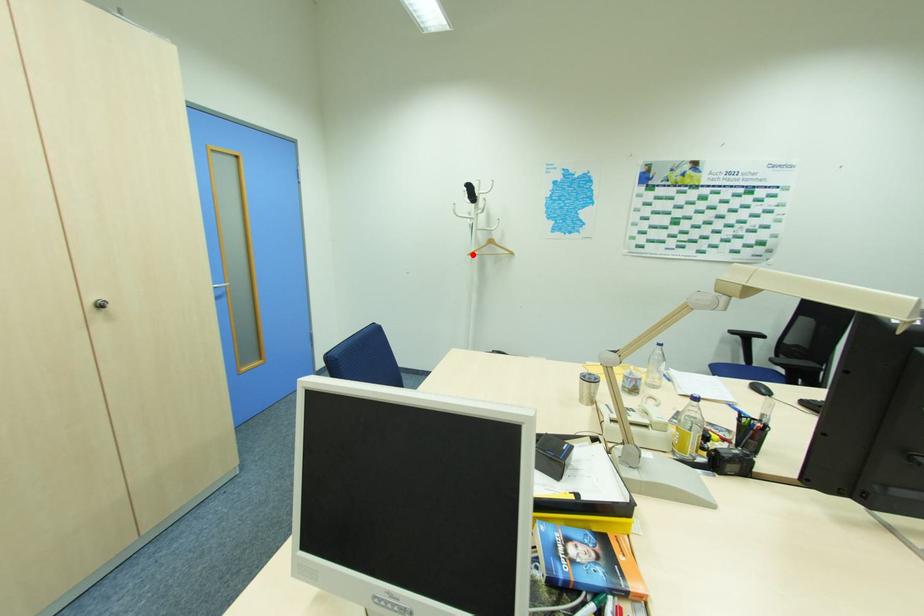
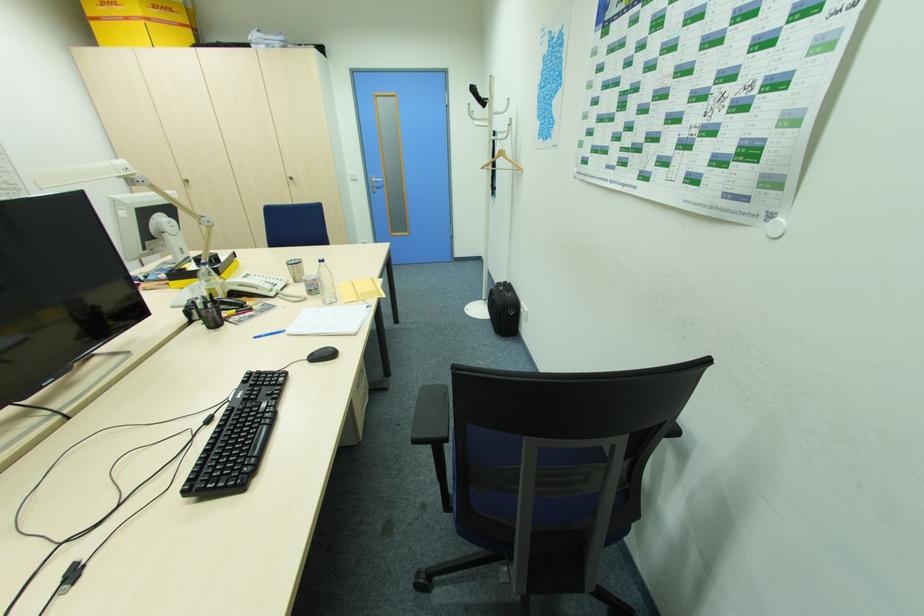
Question: A red point is marked in image1. In image2, is the corresponding 3D point closer to the camera or farther? Reply with the corresponding letter.

Choices:
 (A) The corresponding 3D point is closer.
 (B) The corresponding 3D point is farther.

Answer: (A)